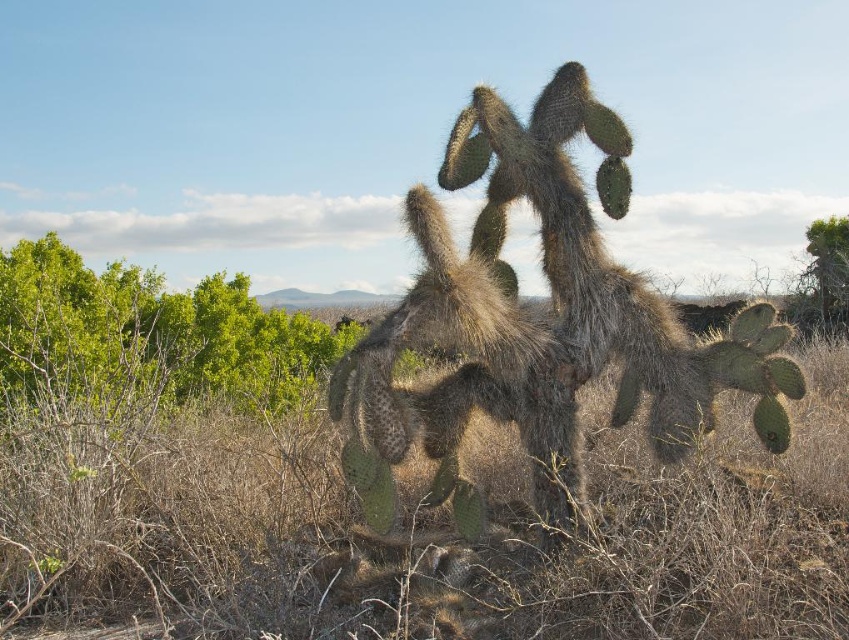
Question: Can you confirm if brown dry grass at center is thinner than spiky green cactus at center?

Choices:
 (A) yes
 (B) no

Answer: (A)

Question: Among these objects, which one is farthest from the camera?

Choices:
 (A) green leafy shrubs at left
 (B) spiky green cactus at center

Answer: (A)

Question: Does brown dry grass at center appear on the left side of spiky green cactus at center?

Choices:
 (A) yes
 (B) no

Answer: (A)

Question: Estimate the real-world distances between objects in this image. Which object is farther from the green leafy shrubs at left?

Choices:
 (A) brown dry grass at center
 (B) spiky green cactus at center

Answer: (B)

Question: Based on their relative distances, which object is nearer to the spiky green cactus at center?

Choices:
 (A) brown dry grass at center
 (B) green leafy shrubs at left

Answer: (A)

Question: From the image, what is the correct spatial relationship of brown dry grass at center in relation to green leafy shrubs at left?

Choices:
 (A) left
 (B) right

Answer: (B)